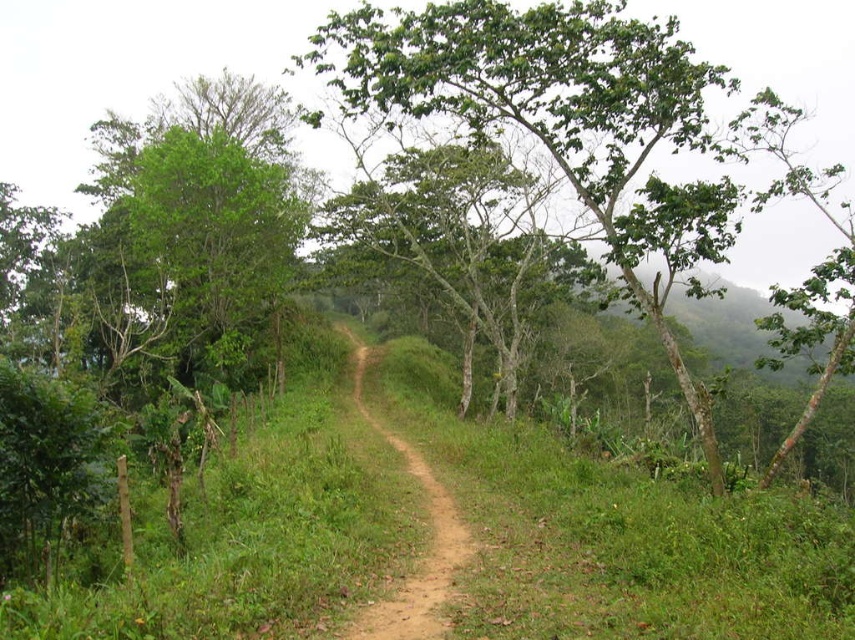
Question: Which object is closer to the camera taking this photo?

Choices:
 (A) green leafy tree at center
 (B) brown dirt track at center

Answer: (B)

Question: Among these objects, which one is farthest from the camera?

Choices:
 (A) brown dirt track at center
 (B) green leafy tree at center

Answer: (B)

Question: Is green leafy tree at center closer to camera compared to brown dirt track at center?

Choices:
 (A) yes
 (B) no

Answer: (B)

Question: Does green leafy tree at center appear on the left side of brown dirt track at center?

Choices:
 (A) yes
 (B) no

Answer: (B)

Question: Can you confirm if green leafy tree at center is positioned to the right of brown dirt track at center?

Choices:
 (A) no
 (B) yes

Answer: (B)